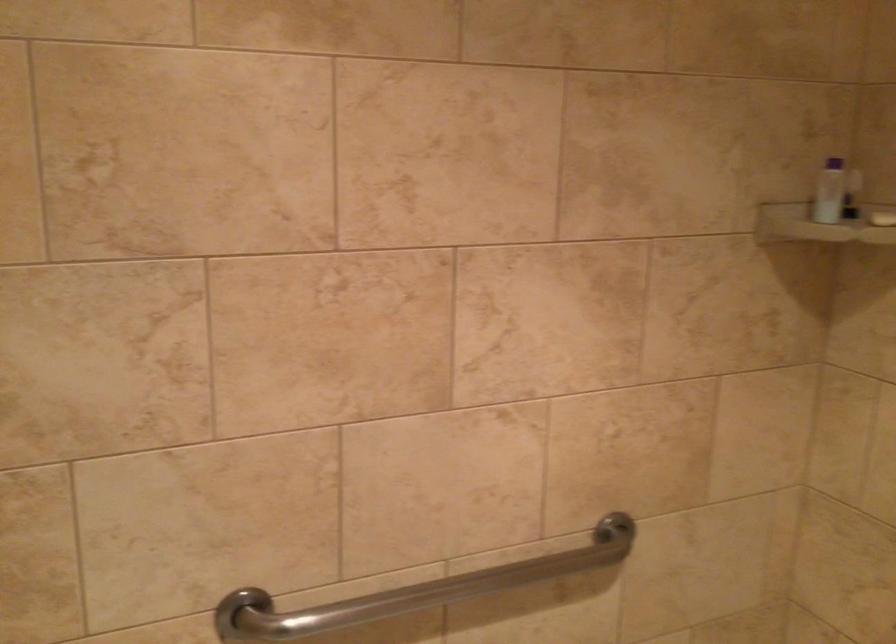
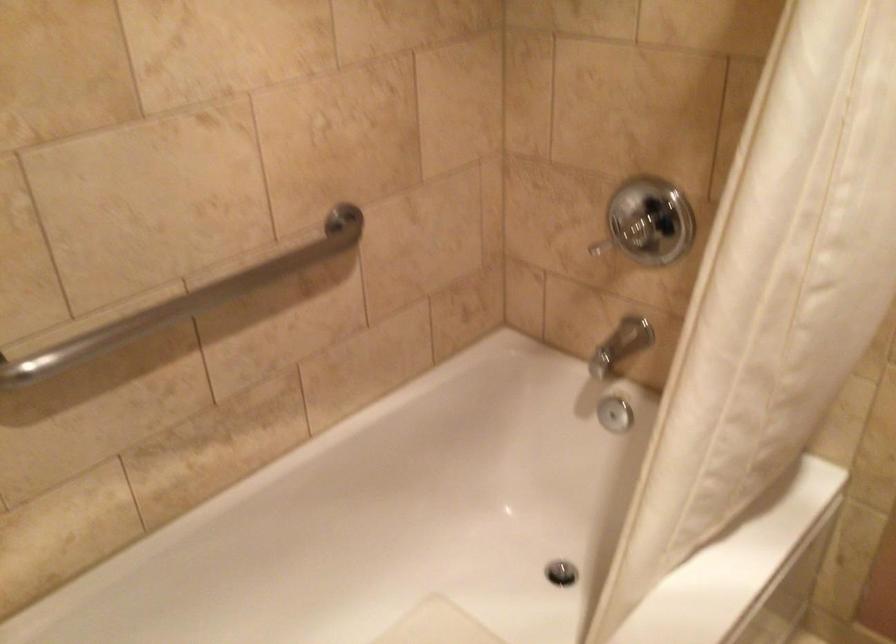
The first image is from the beginning of the video and the second image is from the end. How did the camera likely rotate when shooting the video?

The camera rotated toward right-down.